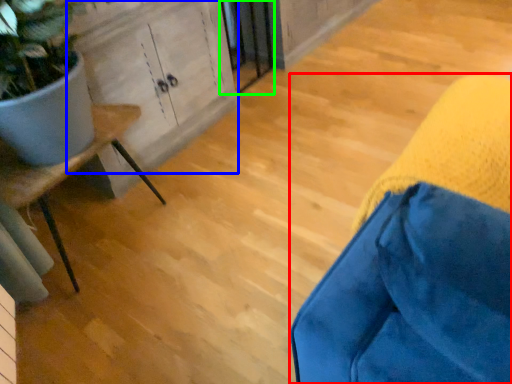
Question: Based on their relative distances, which object is farther from furniture (highlighted by a red box)? Choose from cabinetry (highlighted by a blue box) and screen door (highlighted by a green box).

Choices:
 (A) cabinetry
 (B) screen door

Answer: (B)